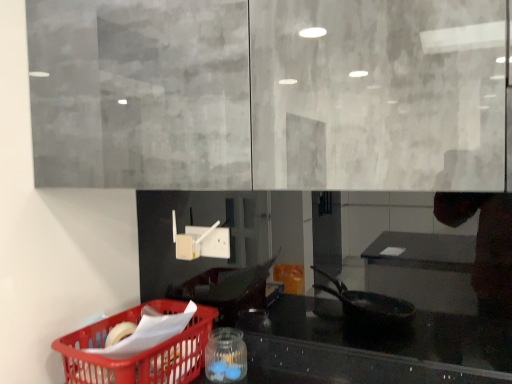
Question: Is transparent glass jar at lower center to the left or to the right of matte plastic basket at lower left in the image?

Choices:
 (A) left
 (B) right

Answer: (B)

Question: In the image, is transparent glass jar at lower center positioned in front of or behind matte plastic basket at lower left?

Choices:
 (A) front
 (B) behind

Answer: (B)

Question: Is point (223, 342) positioned closer to the camera than point (192, 370)?

Choices:
 (A) farther
 (B) closer

Answer: (B)

Question: Is point (153, 369) positioned closer to the camera than point (221, 345)?

Choices:
 (A) closer
 (B) farther

Answer: (A)

Question: From a real-world perspective, is matte plastic basket at lower left positioned above or below transparent glass jar at lower center?

Choices:
 (A) below
 (B) above

Answer: (B)

Question: Considering the positions of matte plastic basket at lower left and transparent glass jar at lower center in the image, is matte plastic basket at lower left wider or thinner than transparent glass jar at lower center?

Choices:
 (A) wide
 (B) thin

Answer: (A)

Question: In the image, is matte plastic basket at lower left positioned in front of or behind transparent glass jar at lower center?

Choices:
 (A) behind
 (B) front

Answer: (B)